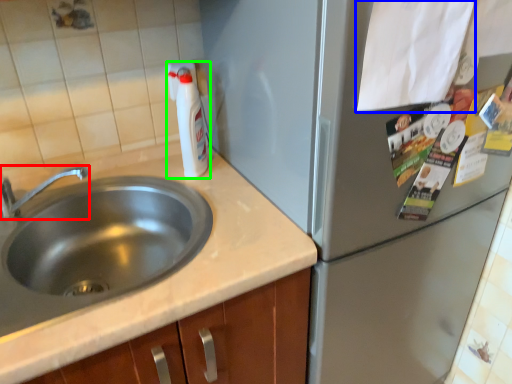
Question: Considering the real-world distances, which object is closest to tap (highlighted by a red box)? paper (highlighted by a blue box) or bottle (highlighted by a green box).

Choices:
 (A) paper
 (B) bottle

Answer: (B)